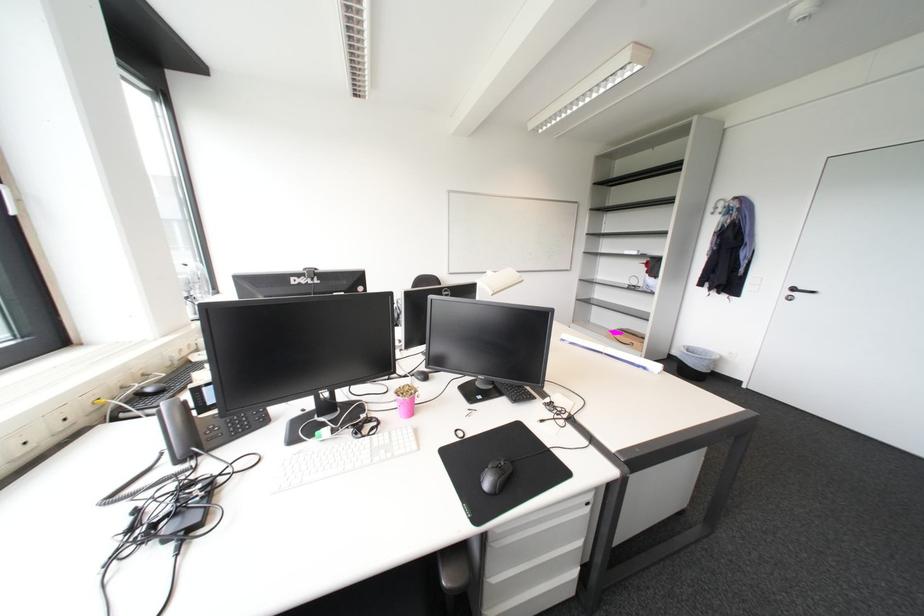
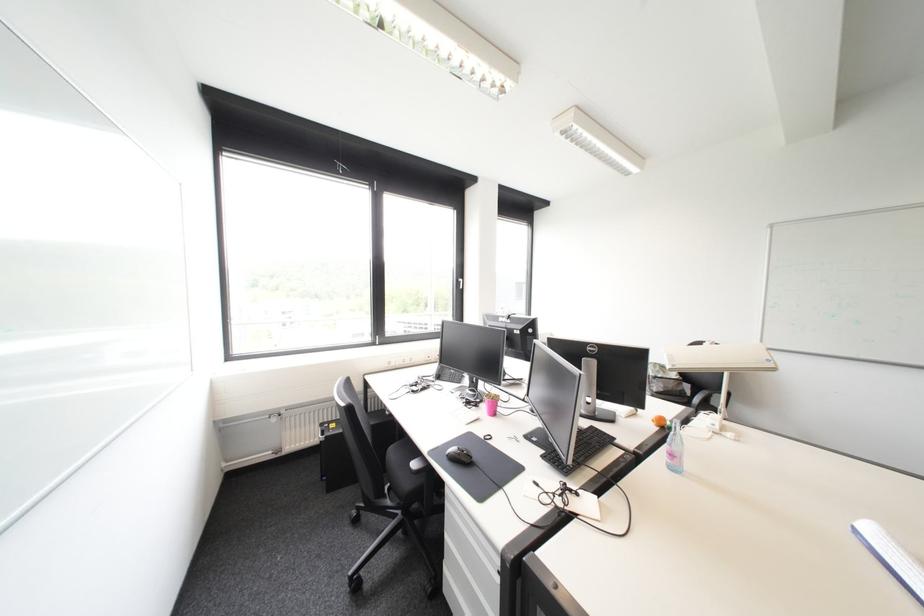
Find the pixel in the second image that matches (x=417, y=399) in the first image.

(495, 400)